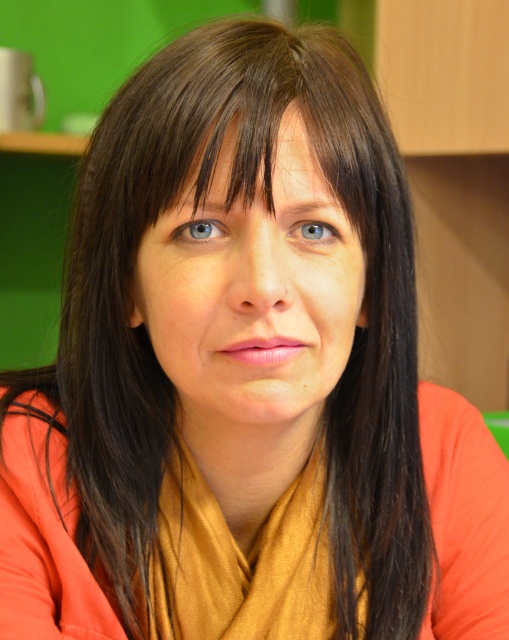
Consider the image. Does smooth skin face at center appear under blue glossy eye at upper center?

Correct, smooth skin face at center is located below blue glossy eye at upper center.

Consider the image. Who is positioned more to the right, smooth skin face at center or blue glossy eye at upper center?

smooth skin face at center

Does point (225, 428) lie behind point (183, 230)?

Yes.

What are the coordinates of `smooth skin face at center` in the screenshot? It's located at (252, 296).

Is blue glossy eye at upper center shorter than blue glossy eye at center?

Incorrect, blue glossy eye at upper center's height does not fall short of blue glossy eye at center's.

Image resolution: width=509 pixels, height=640 pixels. What do you see at coordinates (197, 230) in the screenshot? I see `blue glossy eye at upper center` at bounding box center [197, 230].

I want to click on blue glossy eye at upper center, so click(x=197, y=230).

Does smooth skin face at center have a lesser width compared to blue glossy eye at center?

No, smooth skin face at center is not thinner than blue glossy eye at center.

The height and width of the screenshot is (640, 509). I want to click on smooth skin face at center, so click(x=252, y=296).

Does point (258, 289) come farther from viewer compared to point (293, 225)?

No, (258, 289) is in front of (293, 225).

Identify the location of smooth skin face at center. (252, 296).